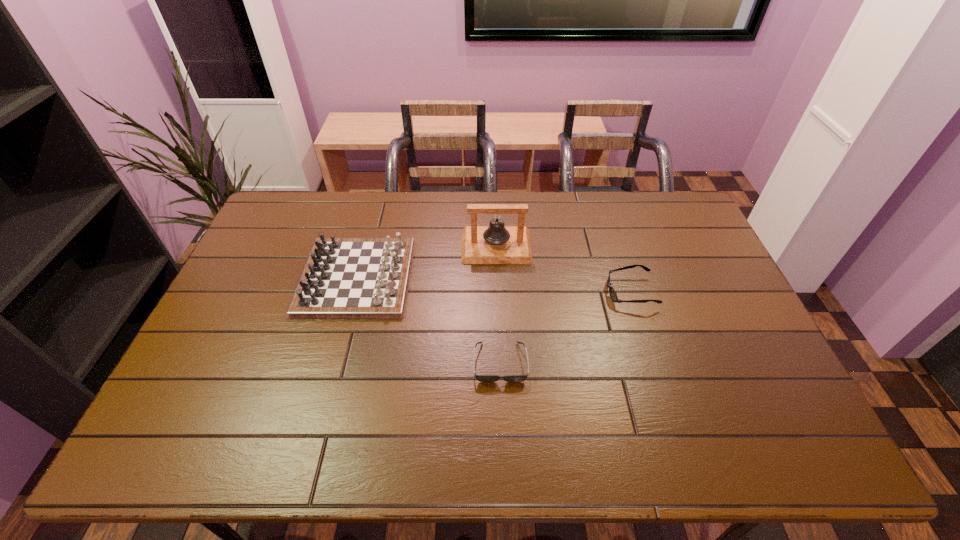
The height and width of the screenshot is (540, 960). I want to click on bell, so click(x=495, y=244).

Where is `chessboard`? Image resolution: width=960 pixels, height=540 pixels. chessboard is located at coordinates (344, 278).

This screenshot has height=540, width=960. What are the coordinates of `the leftmost object` in the screenshot? It's located at (344, 278).

Locate an element on the screen. the taller sunglasses is located at coordinates (612, 292).

What are the coordinates of `the rightmost object` in the screenshot? It's located at (612, 292).

Image resolution: width=960 pixels, height=540 pixels. Find the location of `the nearest object`. the nearest object is located at coordinates (482, 378).

Locate an element on the screen. The width and height of the screenshot is (960, 540). the shorter sunglasses is located at coordinates (482, 378).

At what (x,y) coordinates should I click in order to perform the action: click on free location located 0.250m on the front of the tallest object. Please return your answer as a coordinate pair (x, y). The height and width of the screenshot is (540, 960). Looking at the image, I should click on (499, 325).

Image resolution: width=960 pixels, height=540 pixels. What are the coordinates of `free spot located from the player's perspective of the leftmost object` in the screenshot? It's located at (495, 277).

The width and height of the screenshot is (960, 540). I want to click on vacant space positioned on the lenses of the right sunglasses, so click(544, 292).